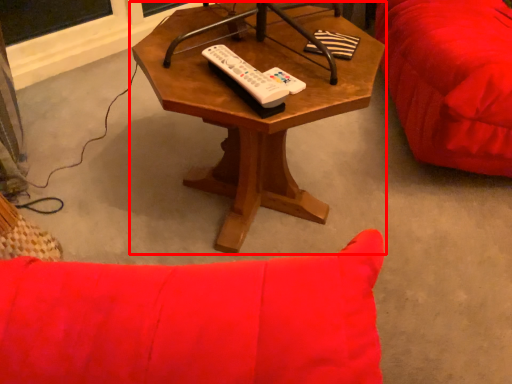
Question: Observing the image, what is the correct spatial positioning of coffee table (annotated by the red box) in reference to remote?

Choices:
 (A) right
 (B) left

Answer: (A)